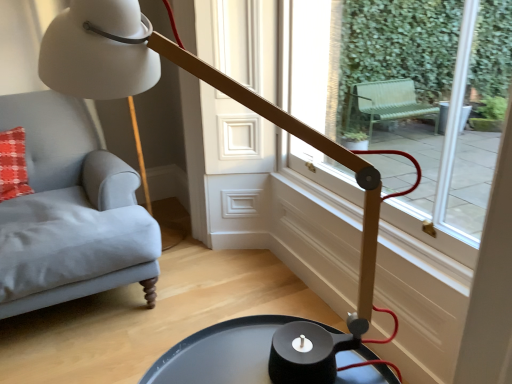
Question: From their relative heights in the image, would you say black matte tray at lower center is taller or shorter than transparent glass window at center?

Choices:
 (A) short
 (B) tall

Answer: (A)

Question: Considering the positions of black matte tray at lower center and transparent glass window at center in the image, is black matte tray at lower center wider or thinner than transparent glass window at center?

Choices:
 (A) thin
 (B) wide

Answer: (B)

Question: Which is correct: black matte tray at lower center is inside transparent glass window at center, or outside of it?

Choices:
 (A) outside
 (B) inside

Answer: (A)

Question: Is point (288, 137) positioned closer to the camera than point (245, 332)?

Choices:
 (A) farther
 (B) closer

Answer: (A)

Question: From the image's perspective, is transparent glass window at center located above or below black matte tray at lower center?

Choices:
 (A) below
 (B) above

Answer: (B)

Question: From their relative heights in the image, would you say transparent glass window at center is taller or shorter than black matte tray at lower center?

Choices:
 (A) short
 (B) tall

Answer: (B)

Question: From a real-world perspective, is transparent glass window at center physically located above or below black matte tray at lower center?

Choices:
 (A) above
 (B) below

Answer: (A)